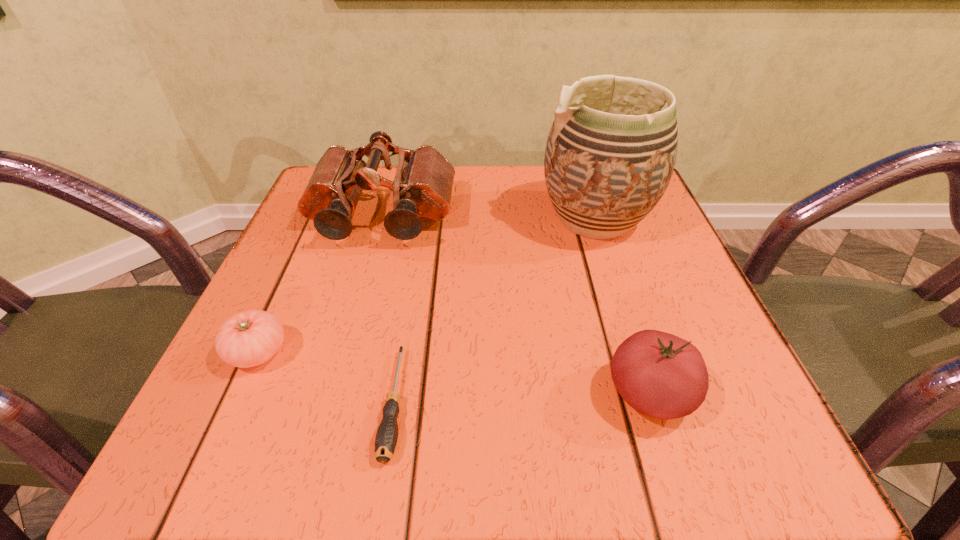
You are a GUI agent. You are given a task and a screenshot of the screen. Output one action in this format:
    pyautogui.click(x=<x>, y=<y>)
    Task: Click on the pottery
    This screenshot has height=540, width=960.
    Given the screenshot: What is the action you would take?
    610,154

Locate an element on the screen. Image resolution: width=960 pixels, height=540 pixels. the second tallest object is located at coordinates (422, 187).

You are a GUI agent. You are given a task and a screenshot of the screen. Output one action in this format:
    pyautogui.click(x=<x>, y=<y>)
    Task: Click on the right tomato
    This screenshot has height=540, width=960.
    Given the screenshot: What is the action you would take?
    (x=660, y=375)

The height and width of the screenshot is (540, 960). I want to click on the third tallest object, so click(660, 375).

The width and height of the screenshot is (960, 540). In order to click on the second shortest object in this screenshot , I will do `click(250, 338)`.

I want to click on the shorter tomato, so click(250, 338).

This screenshot has height=540, width=960. Identify the location of the shortest object. (386, 438).

Where is `free region located on the front of the tallest object`? This screenshot has height=540, width=960. free region located on the front of the tallest object is located at coordinates (634, 334).

The width and height of the screenshot is (960, 540). Identify the location of blank space located 0.170m through the eyepieces of the second tallest object. (354, 318).

At what (x,y) coordinates should I click in order to perform the action: click on free spot located on the back of the right tomato. Please return your answer as a coordinate pair (x, y). Looking at the image, I should click on (610, 271).